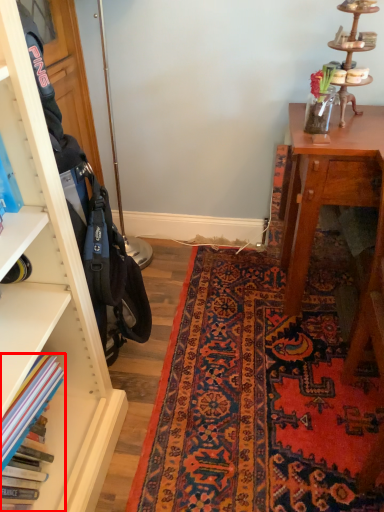
Question: From the image's perspective, where is book (annotated by the red box) located relative to mat?

Choices:
 (A) below
 (B) above

Answer: (A)